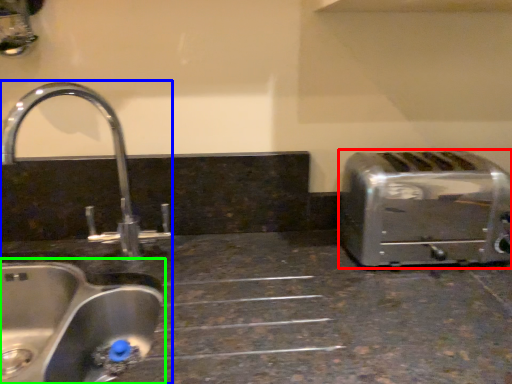
Question: Considering the real-world distances, which object is farthest from toaster (highlighted by a red box)? sink (highlighted by a blue box) or sink (highlighted by a green box)?

Choices:
 (A) sink
 (B) sink

Answer: (A)